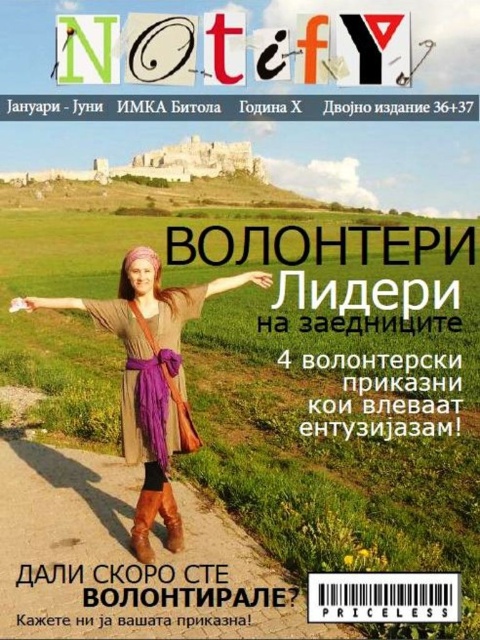
Question: Considering the real-world distances, which object is closest to the purple fabric arm at center?

Choices:
 (A) brown suede boot at lower center
 (B) purple fabric arm at upper center
 (C) brown leather boot at lower center
 (D) brown leather boots at lower center

Answer: (D)

Question: Considering the relative positions of purple fabric arm at upper center and brown suede boot at lower center in the image provided, where is purple fabric arm at upper center located with respect to brown suede boot at lower center?

Choices:
 (A) left
 (B) right

Answer: (A)

Question: Is brown suede boot at lower center closer to camera compared to brown leather boot at lower center?

Choices:
 (A) yes
 (B) no

Answer: (B)

Question: Which of the following is the closest to the observer?

Choices:
 (A) (225, 280)
 (B) (145, 512)

Answer: (B)

Question: From the image, what is the correct spatial relationship of purple fabric arm at upper center in relation to brown leather boot at lower center?

Choices:
 (A) left
 (B) right

Answer: (A)

Question: Estimate the real-world distances between objects in this image. Which object is farther from the purple fabric arm at center?

Choices:
 (A) purple fabric arm at upper center
 (B) brown suede boot at lower center

Answer: (B)